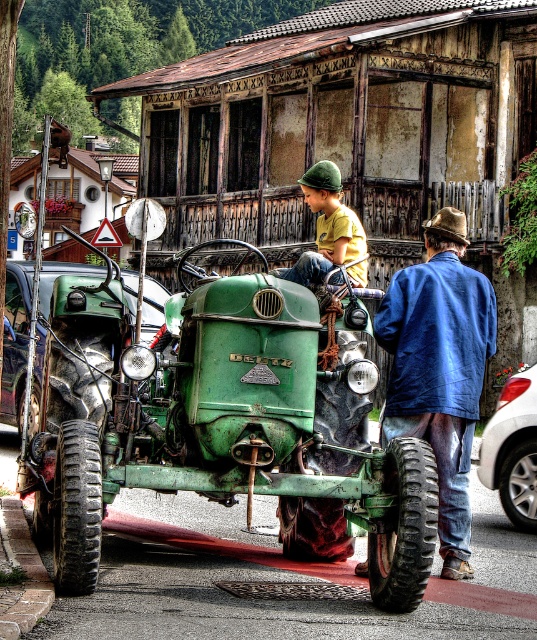
Question: In this image, where is blue corduroy jacket at center located relative to yellow t-shirt at center?

Choices:
 (A) left
 (B) right

Answer: (B)

Question: Among these points, which one is nearest to the camera?

Choices:
 (A) (250, 360)
 (B) (304, 276)
 (C) (460, 316)

Answer: (A)

Question: Which point is farther from the camera taking this photo?

Choices:
 (A) pos(256,416)
 (B) pos(447,429)
 (C) pos(316,202)

Answer: (C)

Question: Is green matte tractor at center bigger than blue corduroy jacket at center?

Choices:
 (A) no
 (B) yes

Answer: (B)

Question: Which of the following is the farthest from the observer?

Choices:
 (A) green matte tractor at center
 (B) yellow t-shirt at center

Answer: (B)

Question: Does green matte tractor at center have a larger size compared to yellow t-shirt at center?

Choices:
 (A) yes
 (B) no

Answer: (A)